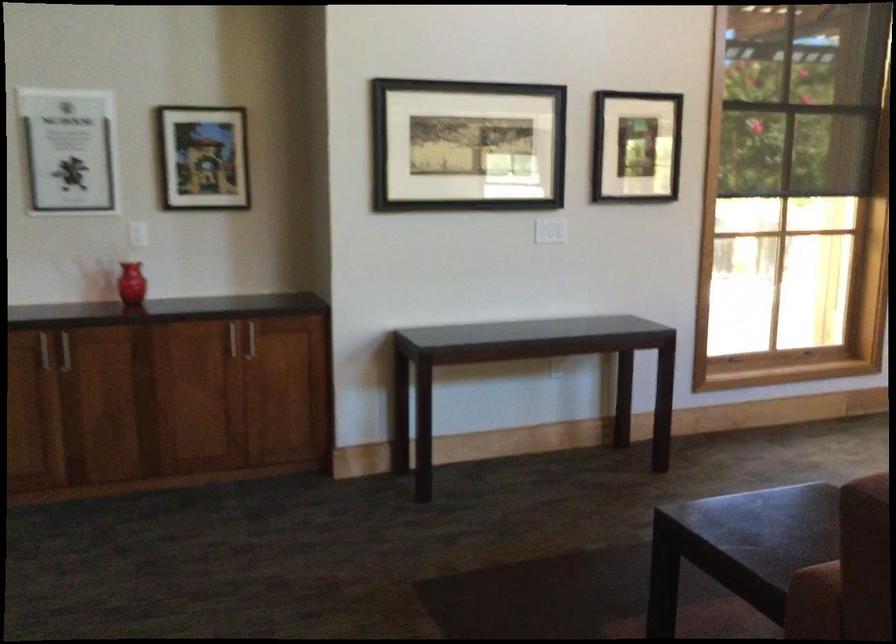
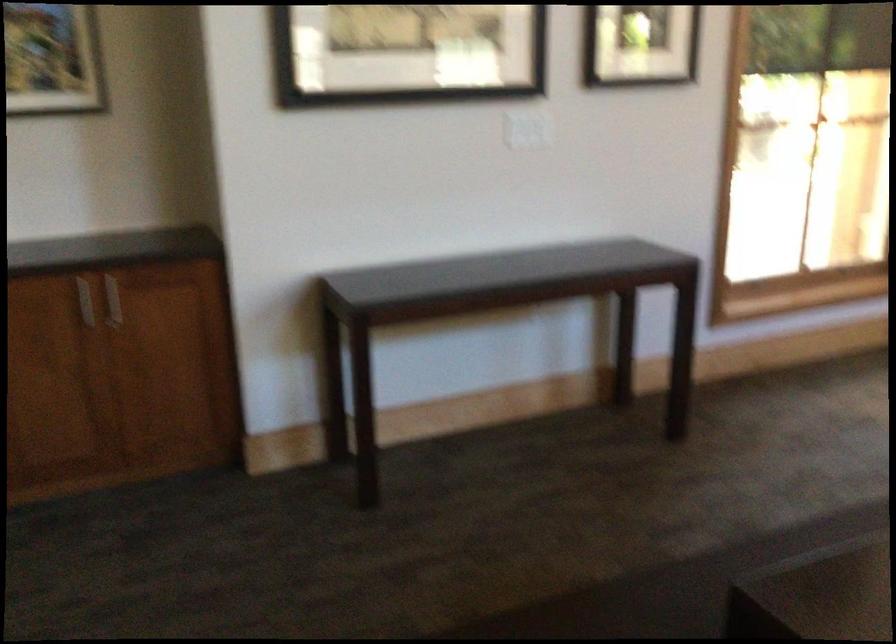
Question: What movement of the cameraman would produce the second image?

Choices:
 (A) Left
 (B) Right
 (C) Forward
 (D) Backward

Answer: (C)